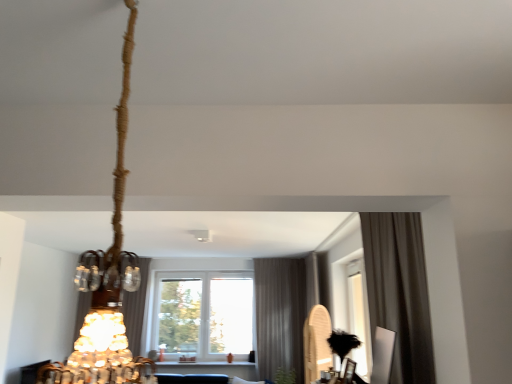
Question: Considering the relative sizes of brown fabric curtain at right, positioned as the third curtain in back-to-front order, and braided rope chandelier at upper left in the image provided, is brown fabric curtain at right, positioned as the third curtain in back-to-front order, thinner than braided rope chandelier at upper left?

Choices:
 (A) yes
 (B) no

Answer: (A)

Question: From the image's perspective, is brown fabric curtain at right, which appears as the 3th curtain when viewed from the left, below braided rope chandelier at upper left?

Choices:
 (A) yes
 (B) no

Answer: (A)

Question: From a real-world perspective, does brown fabric curtain at right, placed as the first curtain when sorted from right to left, stand above braided rope chandelier at upper left?

Choices:
 (A) yes
 (B) no

Answer: (B)

Question: Would you say brown fabric curtain at right, positioned as the third curtain in back-to-front order, is outside braided rope chandelier at upper left?

Choices:
 (A) no
 (B) yes

Answer: (B)

Question: Is brown fabric curtain at right, which is counted as the 1th curtain, starting from the front, looking in the opposite direction of braided rope chandelier at upper left?

Choices:
 (A) yes
 (B) no

Answer: (B)

Question: Is brown fabric curtain at right, placed as the first curtain when sorted from right to left, in front of braided rope chandelier at upper left?

Choices:
 (A) yes
 (B) no

Answer: (B)

Question: Considering the relative positions of satin brown curtain at center, placed as the first curtain when sorted from left to right, and green leafy plant at lower center in the image provided, is satin brown curtain at center, placed as the first curtain when sorted from left to right, in front of green leafy plant at lower center?

Choices:
 (A) no
 (B) yes

Answer: (A)

Question: Is satin brown curtain at center, acting as the first curtain starting from the back, smaller than green leafy plant at lower center?

Choices:
 (A) yes
 (B) no

Answer: (B)

Question: From the image's perspective, is satin brown curtain at center, placed as the first curtain when sorted from left to right, below green leafy plant at lower center?

Choices:
 (A) yes
 (B) no

Answer: (A)

Question: Is satin brown curtain at center, which is counted as the 3th curtain, starting from the front, located outside green leafy plant at lower center?

Choices:
 (A) no
 (B) yes

Answer: (B)

Question: Does satin brown curtain at center, placed as the first curtain when sorted from left to right, have a lesser height compared to green leafy plant at lower center?

Choices:
 (A) yes
 (B) no

Answer: (B)

Question: Can you confirm if satin brown curtain at center, which is counted as the 3th curtain, starting from the front, is positioned to the right of green leafy plant at lower center?

Choices:
 (A) yes
 (B) no

Answer: (B)

Question: Is satin brown curtain at center, which is counted as the 3th curtain, starting from the front, completely or partially outside of brown fabric curtain at right, placed as the first curtain when sorted from right to left?

Choices:
 (A) no
 (B) yes

Answer: (B)